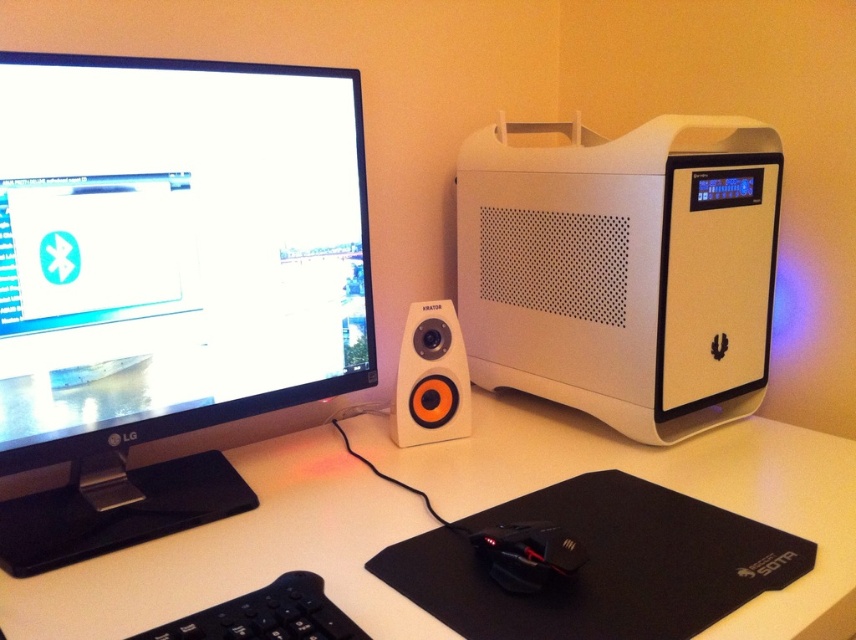
Between white matte computer tower at right and white matte computer desk at center, which one has less height?

With less height is white matte computer desk at center.

Can you confirm if white matte computer tower at right is wider than white matte computer desk at center?

No, white matte computer tower at right is not wider than white matte computer desk at center.

Where is `white matte computer tower at right`? This screenshot has width=856, height=640. white matte computer tower at right is located at coordinates (622, 268).

Can you confirm if black glossy monitor at left is wider than black matte keyboard at lower left?

Correct, the width of black glossy monitor at left exceeds that of black matte keyboard at lower left.

Is black glossy monitor at left shorter than black matte keyboard at lower left?

Incorrect, black glossy monitor at left's height does not fall short of black matte keyboard at lower left's.

The image size is (856, 640). Describe the element at coordinates (167, 284) in the screenshot. I see `black glossy monitor at left` at that location.

The width and height of the screenshot is (856, 640). In order to click on black glossy monitor at left in this screenshot , I will do `click(167, 284)`.

Between white matte computer desk at center and black matte keyboard at lower left, which one has less height?

With less height is black matte keyboard at lower left.

Who is more distant from viewer, (314, 454) or (155, 632)?

Point (314, 454)

Based on the photo, who is more distant from viewer, (327, 541) or (316, 593)?

The point (327, 541) is behind.

Locate an element on the screen. The image size is (856, 640). white matte computer desk at center is located at coordinates (661, 484).